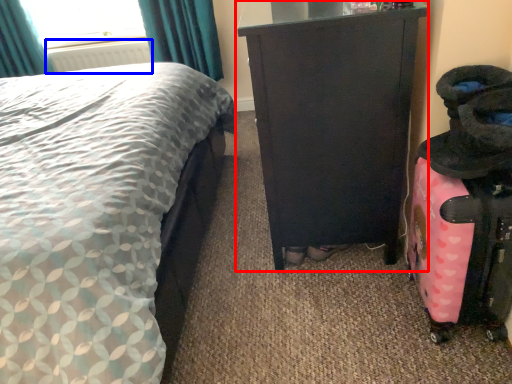
Question: Which object is closer to the camera taking this photo, furniture (highlighted by a red box) or radiator (highlighted by a blue box)?

Choices:
 (A) furniture
 (B) radiator

Answer: (A)